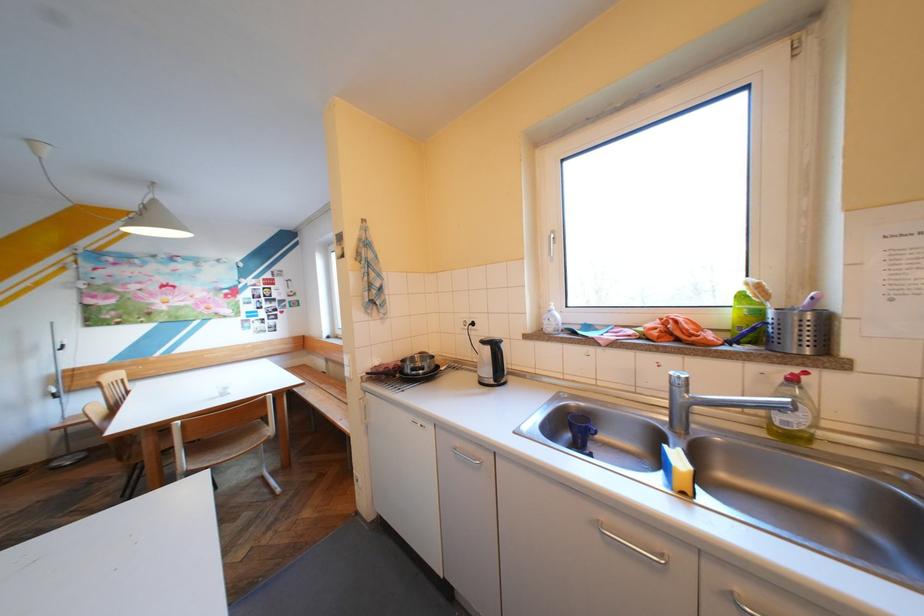
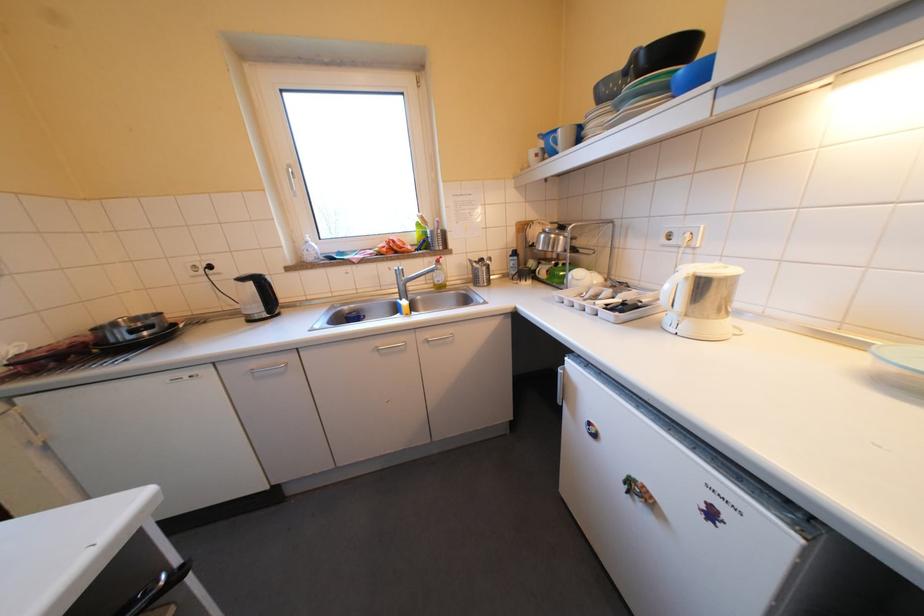
Locate, in the second image, the point that corresponds to (x=749, y=588) in the first image.

(440, 336)